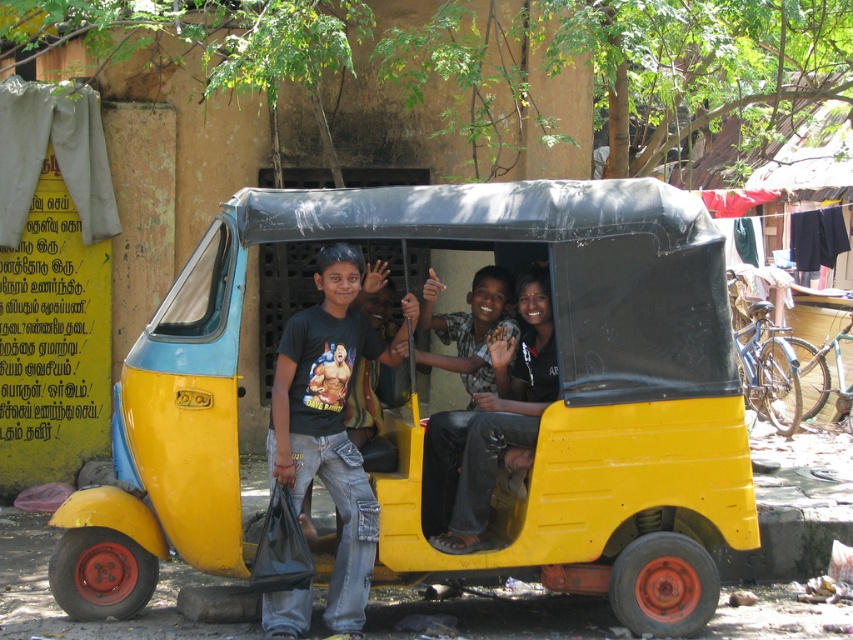
Consider the image. Is yellow matte tricycle at center closer to the viewer compared to black t-shirt at center?

Yes, yellow matte tricycle at center is in front of black t-shirt at center.

Consider the image. Does yellow matte tricycle at center appear on the left side of black t-shirt at center?

No, yellow matte tricycle at center is not to the left of black t-shirt at center.

The height and width of the screenshot is (640, 853). I want to click on yellow matte tricycle at center, so click(422, 429).

You are a GUI agent. You are given a task and a screenshot of the screen. Output one action in this format:
    pyautogui.click(x=<x>, y=<y>)
    Task: Click on the yellow matte tricycle at center
    This screenshot has width=853, height=640.
    Given the screenshot: What is the action you would take?
    pyautogui.click(x=422, y=429)

Can you confirm if yellow matte tricycle at center is positioned above matte black shirt at center?

Incorrect, yellow matte tricycle at center is not positioned above matte black shirt at center.

The width and height of the screenshot is (853, 640). Describe the element at coordinates (422, 429) in the screenshot. I see `yellow matte tricycle at center` at that location.

In order to click on yellow matte tricycle at center in this screenshot , I will do `click(422, 429)`.

Image resolution: width=853 pixels, height=640 pixels. What do you see at coordinates (329, 420) in the screenshot?
I see `black t-shirt at center` at bounding box center [329, 420].

Who is lower down, black t-shirt at center or matte black shirt at center?

Positioned lower is black t-shirt at center.

Does point (339, 316) come farther from viewer compared to point (531, 417)?

Yes, it is behind point (531, 417).

Identify the location of black t-shirt at center. (329, 420).